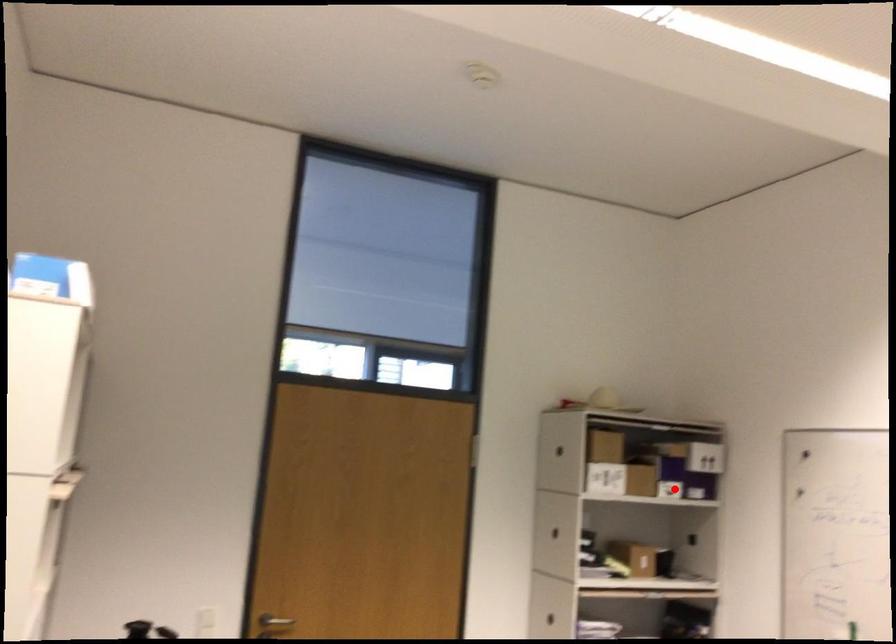
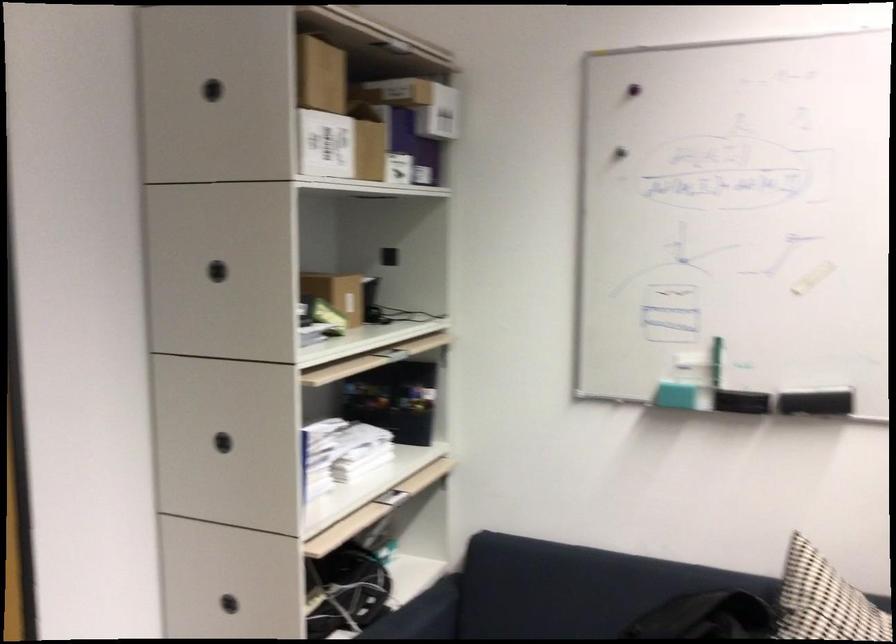
Question: I am providing you with two images of the same scene from different viewpoints. A red point is shown in image1. For the corresponding object point in image2, is it positioned nearer or farther from the camera?

Choices:
 (A) Nearer
 (B) Farther

Answer: (A)